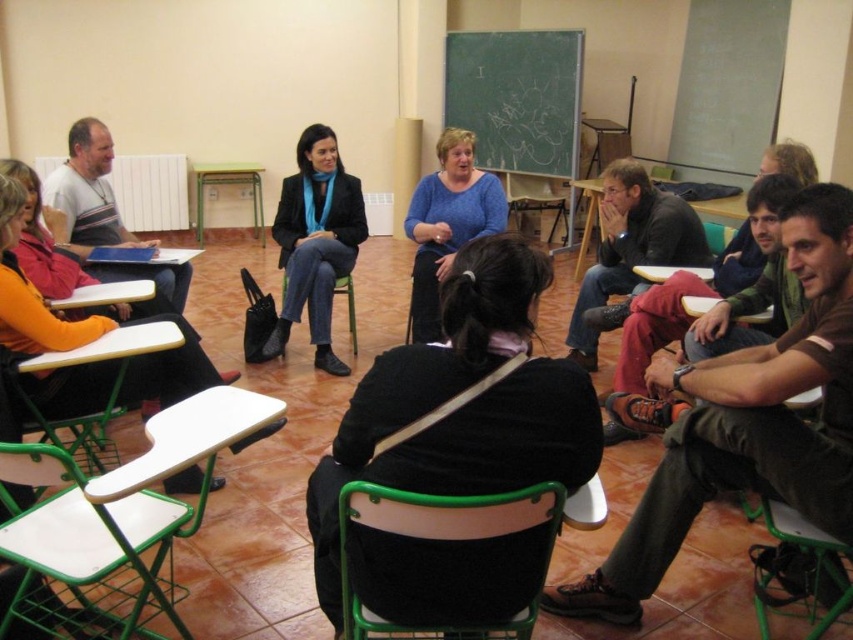
Who is more forward, [38,333] or [181,461]?

Point [181,461]

Is orange sweater at left in front of green plastic chair at lower left?

No, orange sweater at left is behind green plastic chair at lower left.

Does point (33, 346) come behind point (163, 456)?

Yes, point (33, 346) is farther from viewer.

The height and width of the screenshot is (640, 853). What are the coordinates of `orange sweater at left` in the screenshot? It's located at (32, 291).

Does matte black blazer at center appear over green plastic chair at lower left?

Yes, matte black blazer at center is above green plastic chair at lower left.

Does point (323, 275) lie in front of point (149, 481)?

No, it is behind (149, 481).

Identify the location of matte black blazer at center. The image size is (853, 640). (315, 243).

Between green plastic chair at lower left and green plastic chair at center, which one is positioned higher?

green plastic chair at center

Does green plastic chair at lower left have a greater height compared to green plastic chair at center?

Yes, green plastic chair at lower left is taller than green plastic chair at center.

Which is behind, point (125, 468) or point (283, 273)?

Point (283, 273)

This screenshot has height=640, width=853. I want to click on green plastic chair at lower left, so pyautogui.click(x=187, y=438).